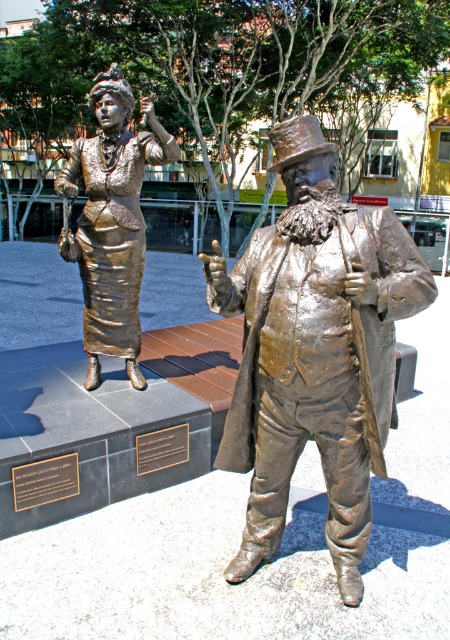
You are an art student analyzing the statues in the plaza. You observe the shiny gold dress at left and the black polished metal plaque at center. Which object has a greater width?

The shiny gold dress at left has a greater width than the black polished metal plaque at center.

What is located at the coordinates point (112, 220) in the image?

The shiny gold dress at left is located at point (112, 220).